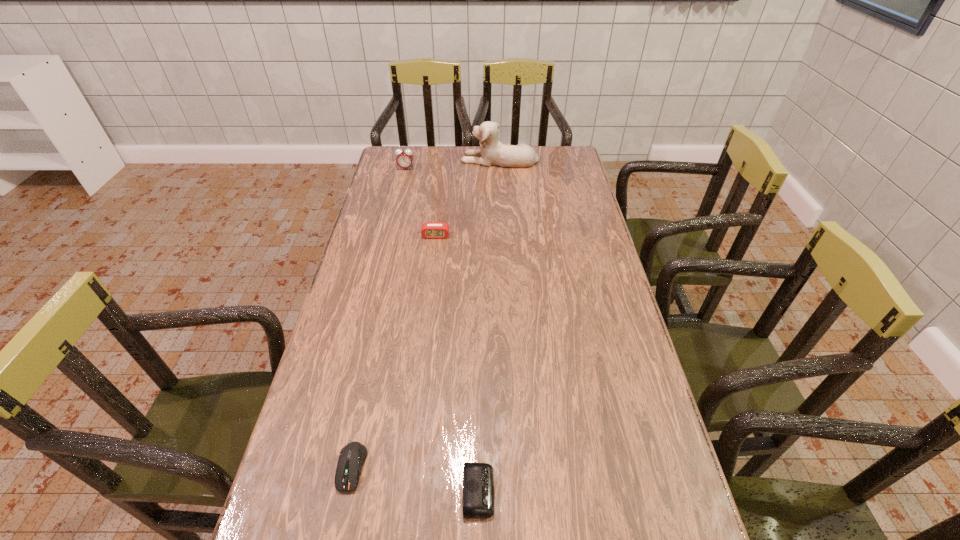
The width and height of the screenshot is (960, 540). I want to click on unoccupied area between the second shortest alarm clock and the tallest object, so click(468, 198).

Find the location of a particular element. free space between the tallest alarm clock and the third object from right to left is located at coordinates (420, 202).

You are a GUI agent. You are given a task and a screenshot of the screen. Output one action in this format:
    pyautogui.click(x=<x>, y=<y>)
    Task: Click on the vacant point located between the third object from left to right and the nearest alarm clock
    
    Given the screenshot: What is the action you would take?
    [457, 363]

This screenshot has width=960, height=540. In order to click on free spot between the second shortest object and the shortest alarm clock in this screenshot , I will do click(x=415, y=479).

At what (x,y) coordinates should I click in order to perform the action: click on unoccupied position between the shortest alarm clock and the tallest alarm clock. Please return your answer as a coordinate pair (x, y). This screenshot has width=960, height=540. Looking at the image, I should click on (443, 330).

Select which object appears as the closest to the puppy. Please provide its 2D coordinates. Your answer should be formatted as a tuple, i.e. [(x, y)], where the tuple contains the x and y coordinates of a point satisfying the conditions above.

[(404, 159)]

Image resolution: width=960 pixels, height=540 pixels. In order to click on the third closest object to the puppy in this screenshot , I will do `click(352, 456)`.

Select which alarm clock appears as the second closest to the fourth shortest object. Please provide its 2D coordinates. Your answer should be formatted as a tuple, i.e. [(x, y)], where the tuple contains the x and y coordinates of a point satisfying the conditions above.

[(478, 478)]

You are a GUI agent. You are given a task and a screenshot of the screen. Output one action in this format:
    pyautogui.click(x=<x>, y=<y>)
    Task: Click on the alarm clock that is the third closest to the puppy
    Image resolution: width=960 pixels, height=540 pixels.
    Given the screenshot: What is the action you would take?
    pyautogui.click(x=478, y=478)

This screenshot has width=960, height=540. What are the coordinates of `free spot that satisfies the following two spatial constraints: 1. on the front-facing side of the tallest object; 2. on the clock face of the farthest alarm clock` in the screenshot? It's located at (500, 168).